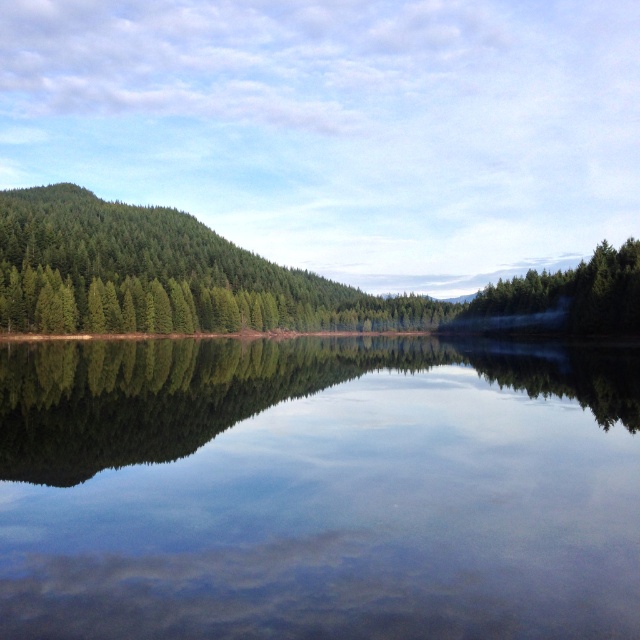
Is clear glass lake at center bigger than green textured forest at left?

Actually, clear glass lake at center might be smaller than green textured forest at left.

Between clear glass lake at center and green textured forest at left, which one is positioned higher?

green textured forest at left is above.

Identify the location of clear glass lake at center. The image size is (640, 640). (317, 490).

The width and height of the screenshot is (640, 640). In order to click on clear glass lake at center in this screenshot , I will do `click(317, 490)`.

Is clear glass lake at center in front of green matte tree at right?

Yes.

The image size is (640, 640). Describe the element at coordinates (317, 490) in the screenshot. I see `clear glass lake at center` at that location.

Is point (483, 632) more distant than point (600, 266)?

No, (483, 632) is in front of (600, 266).

Where is `clear glass lake at center`? The height and width of the screenshot is (640, 640). clear glass lake at center is located at coordinates (317, 490).

Who is taller, green textured forest at left or green matte tree at right?

green textured forest at left is taller.

Does green textured forest at left have a greater height compared to green matte tree at right?

Yes.

Which is behind, point (358, 323) or point (509, 316)?

The point (358, 323) is behind.

I want to click on green textured forest at left, so click(x=161, y=275).